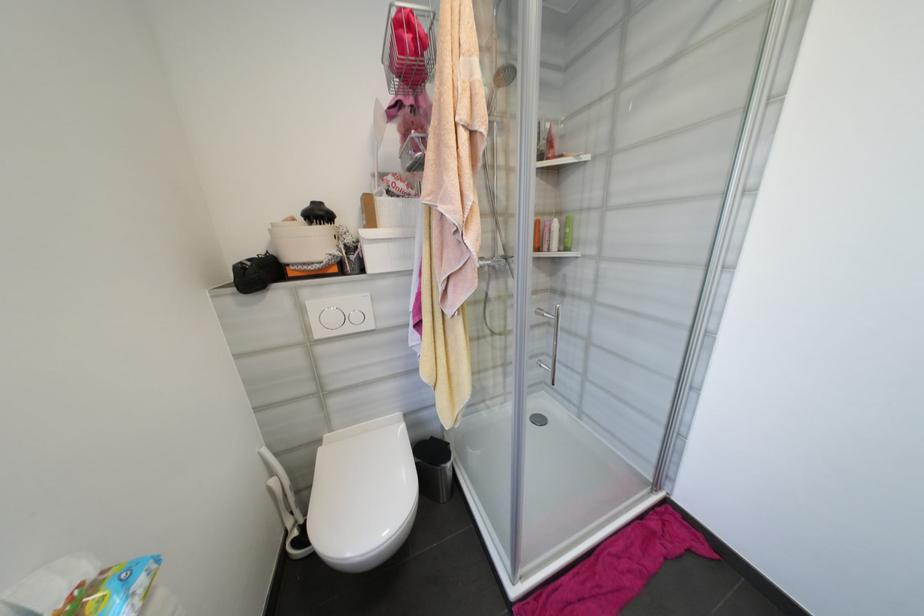
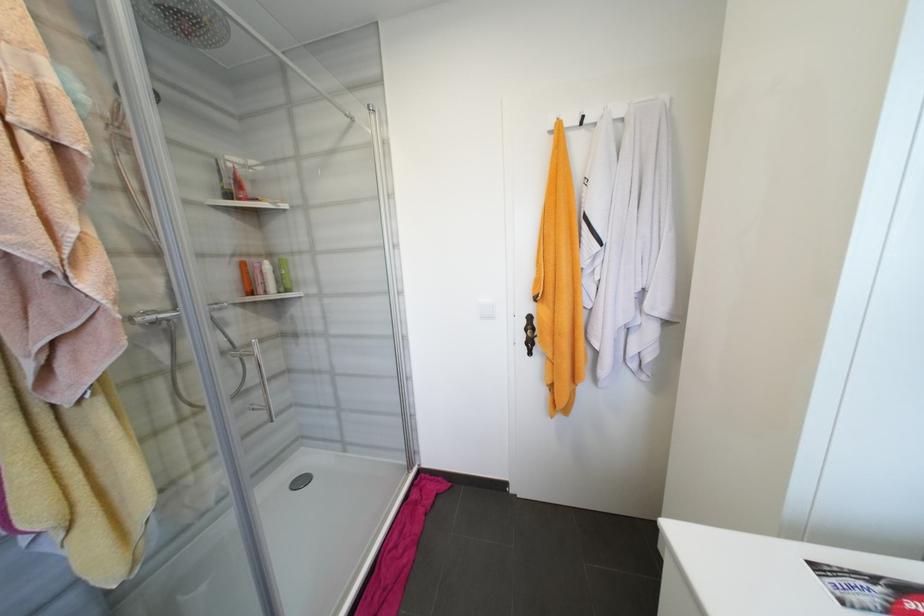
Question: The camera is either moving clockwise (left) or counter-clockwise (right) around the object. The first image is from the beginning of the video and the second image is from the end. Is the camera moving left or right when shooting the video?

Choices:
 (A) Left
 (B) Right

Answer: (A)